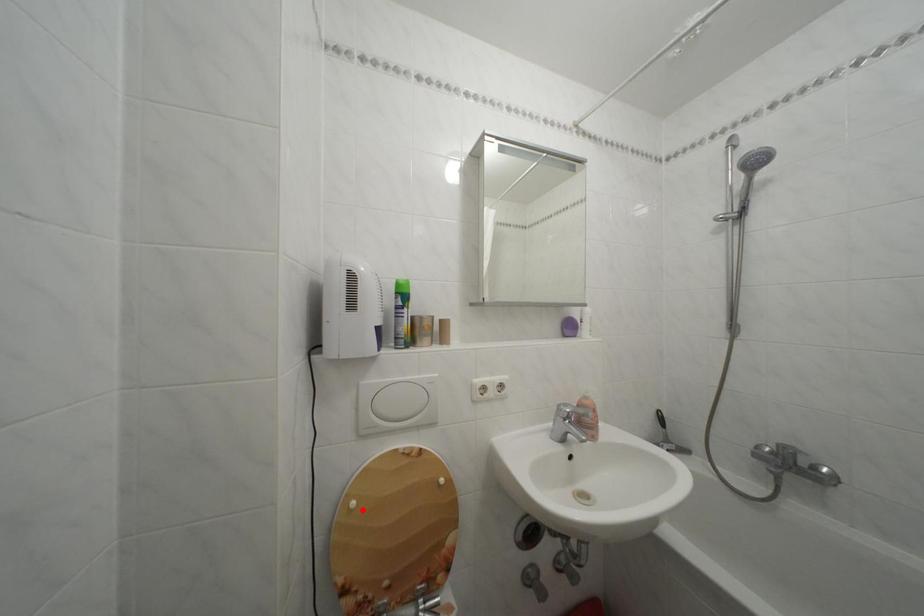
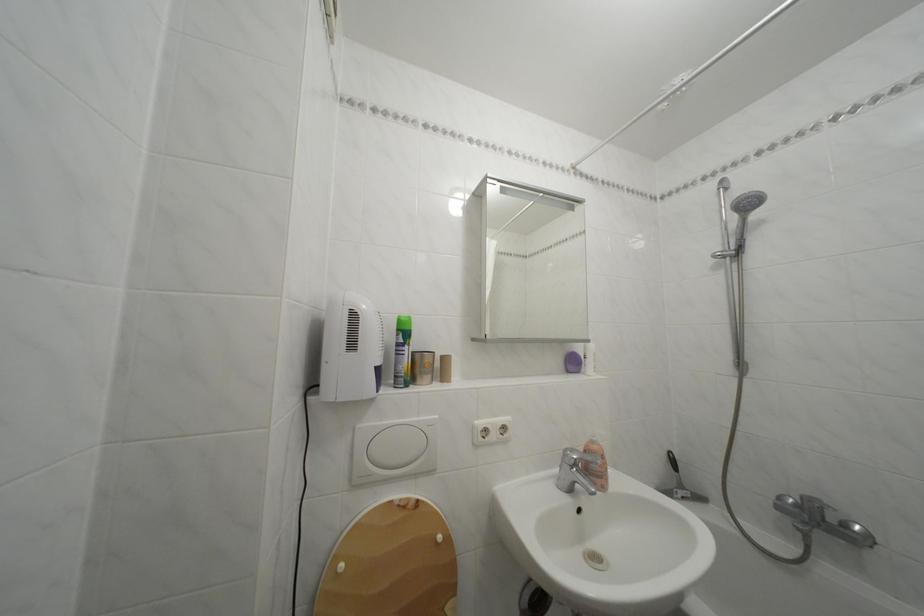
Question: I am providing you with two images of the same scene from different viewpoints. Image1 has a red point marked. In image2, the corresponding 3D location appears at what relative position? Reply with the corresponding letter.

Choices:
 (A) Closer
 (B) Farther

Answer: (A)